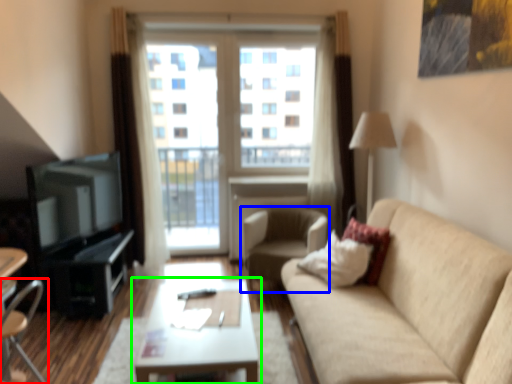
Question: Which is farther away from chair (highlighted by a red box)? chair (highlighted by a blue box) or coffee table (highlighted by a green box)?

Choices:
 (A) chair
 (B) coffee table

Answer: (A)